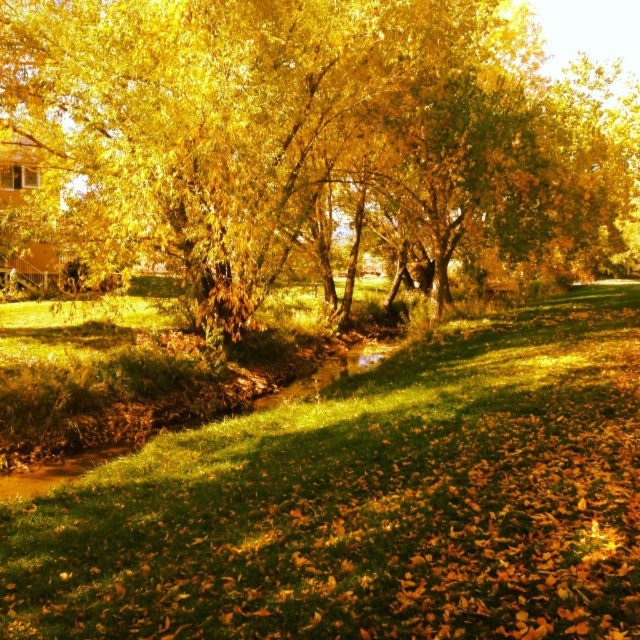
Question: Which point is closer to the camera?

Choices:
 (A) golden leafy tree at center
 (B) green grass at center

Answer: (B)

Question: Can you confirm if golden leafy tree at center is bigger than green grass at center?

Choices:
 (A) no
 (B) yes

Answer: (B)

Question: In this image, where is golden leafy tree at center located relative to green grass at center?

Choices:
 (A) left
 (B) right

Answer: (B)

Question: Can you confirm if golden leafy tree at center is positioned below green grass at center?

Choices:
 (A) no
 (B) yes

Answer: (A)

Question: Among these points, which one is nearest to the camera?

Choices:
 (A) (131, 486)
 (B) (608, 228)

Answer: (A)

Question: Which point is farther to the camera?

Choices:
 (A) (28, 109)
 (B) (579, 422)

Answer: (A)